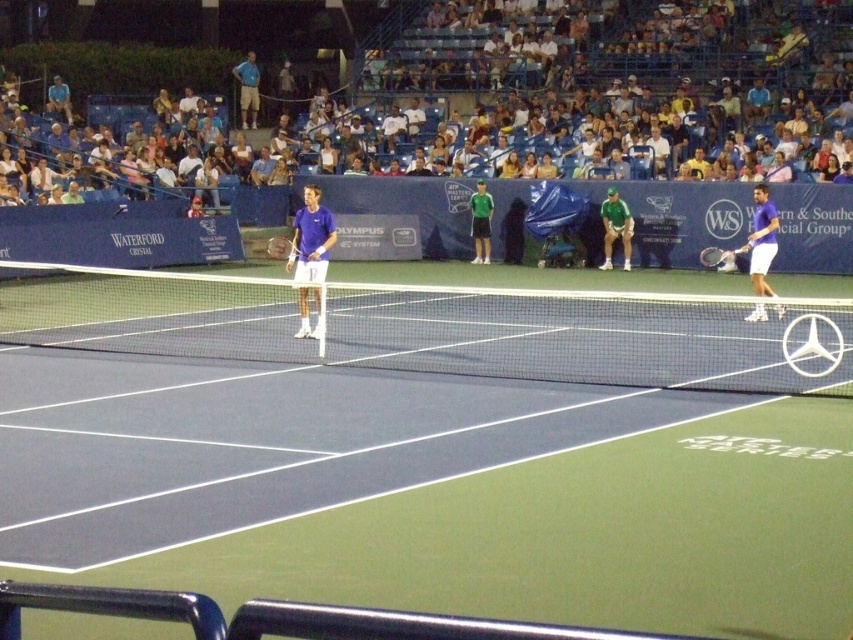
You are a tennis ball that just landed at point (756,273) on the court. The camera is positioned at a height of 2.5 meters. Can you estimate how far you are from the camera in meters?

The distance between the point (756,273) and the camera is 18.66 meters.

You are a tennis player preparing to serve during a night match. You notice the white mesh net at center and the matte blue racket at center. Which object is taller?

The white mesh net at center is much taller than the matte blue racket at center.

In the scene shown: You are a tennis ball that just got hit towards the purple matte tennis racket at right and the green matte shirt at center. Which object will you hit first?

The purple matte tennis racket at right is in front of the green matte shirt at center, so the tennis ball will hit the purple matte tennis racket at right first.